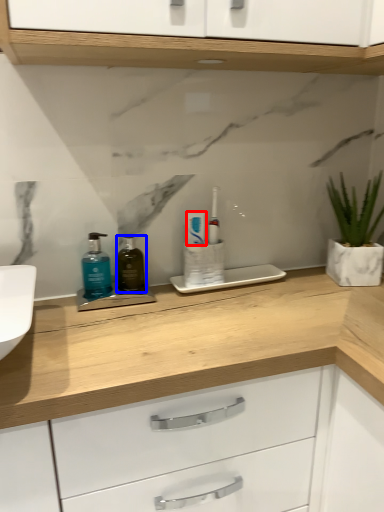
Question: Which object is further to the camera taking this photo, toothpaste (highlighted by a red box) or mouthwash (highlighted by a blue box)?

Choices:
 (A) toothpaste
 (B) mouthwash

Answer: (A)